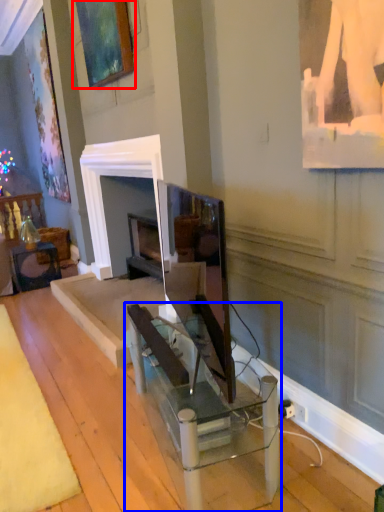
Question: Which object is further to the camera taking this photo, picture frame (highlighted by a red box) or table (highlighted by a blue box)?

Choices:
 (A) picture frame
 (B) table

Answer: (A)